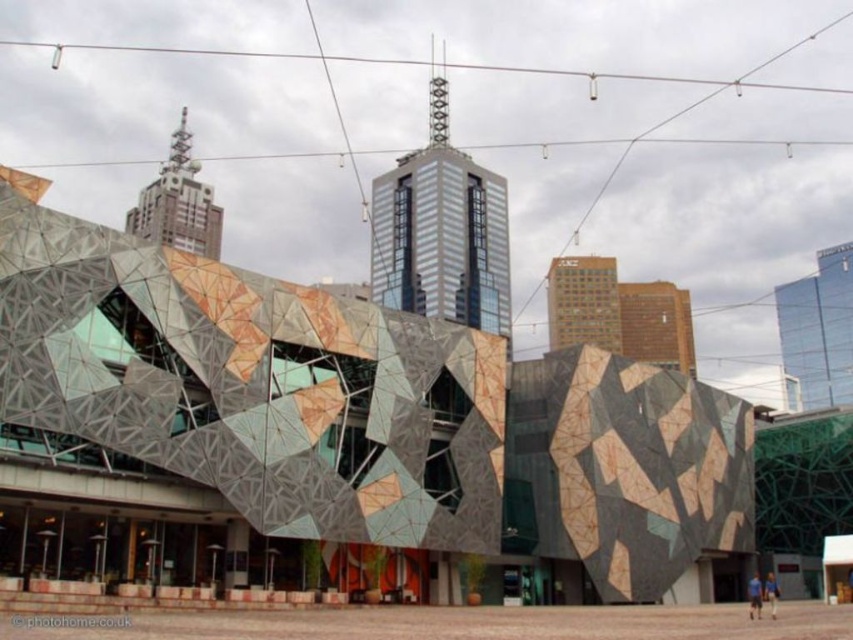
You are an architect analyzing the image of the city skyline. You need to determine the spatial relationship between the glassy steel skyscraper at center and the glassy reflective skyscraper at upper right. Based on the scene, which skyscraper is farther away from the viewer?

The glassy reflective skyscraper at upper right is farther away from the viewer because it is positioned behind the glassy steel skyscraper at center.

You are an architect analyzing the cityscape. You need to determine the spatial relationship between the glassy reflective skyscraper at upper right and the metallic glass skyscraper at upper center. Which one appears closer to the viewer based on their positions in the image?

The glassy reflective skyscraper at upper right is in front of the metallic glass skyscraper at upper center, so it appears closer to the viewer.

You are an architect evaluating two skyscrapers in the city. You see the glassy steel skyscraper at center and the glassy reflective skyscraper at upper right. Which one is taller?

The glassy steel skyscraper at center is taller than the glassy reflective skyscraper at upper right.